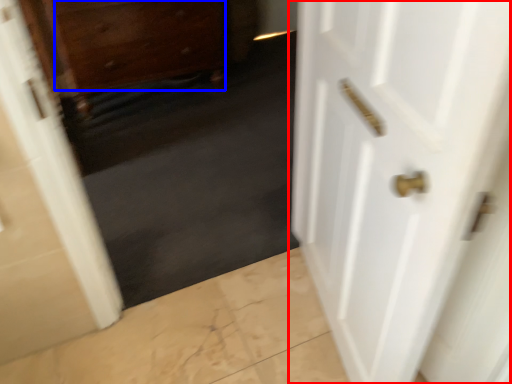
Question: Which object appears farthest to the camera in this image, door (highlighted by a red box) or drawer (highlighted by a blue box)?

Choices:
 (A) door
 (B) drawer

Answer: (B)